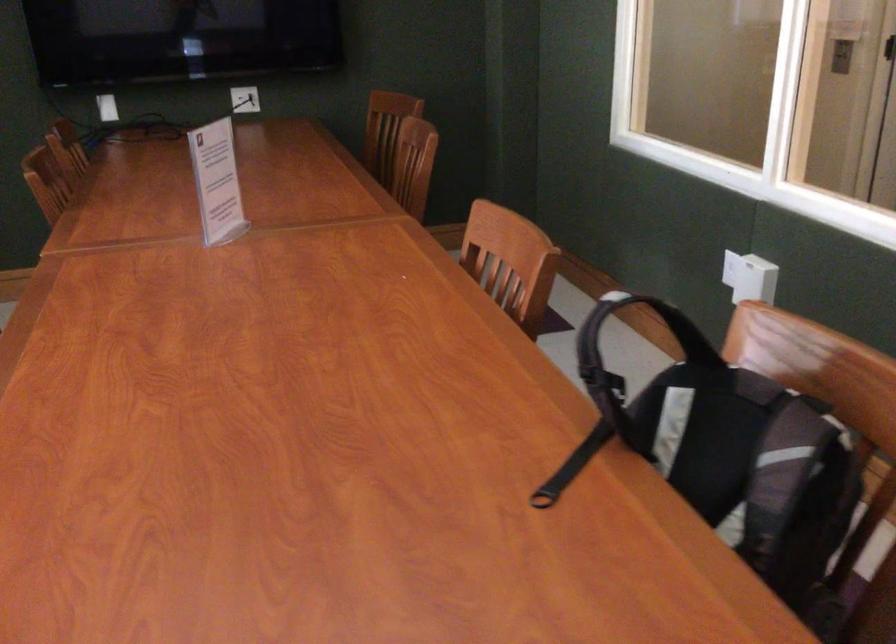
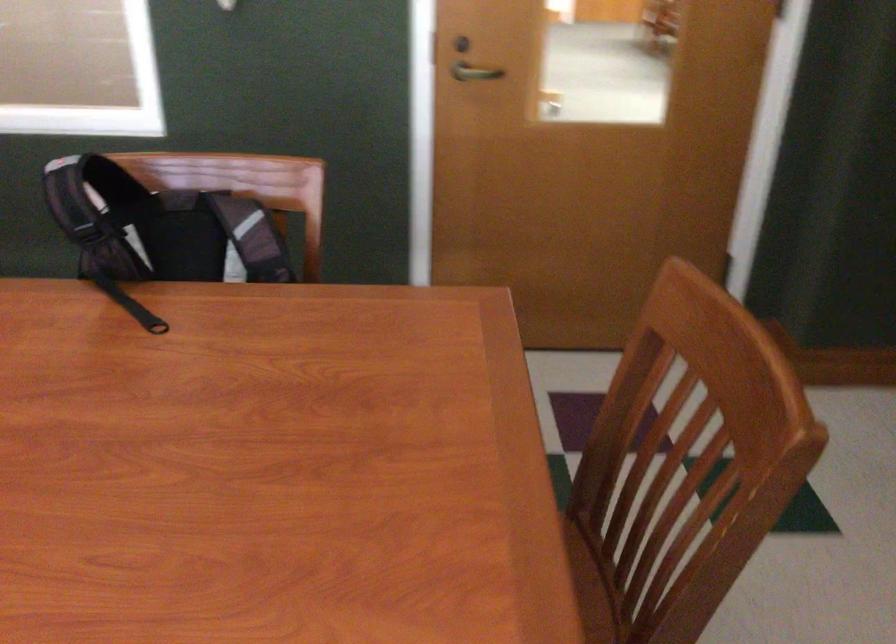
In the second image, find the point that corresponds to the point at 716,402 in the first image.

(159, 228)